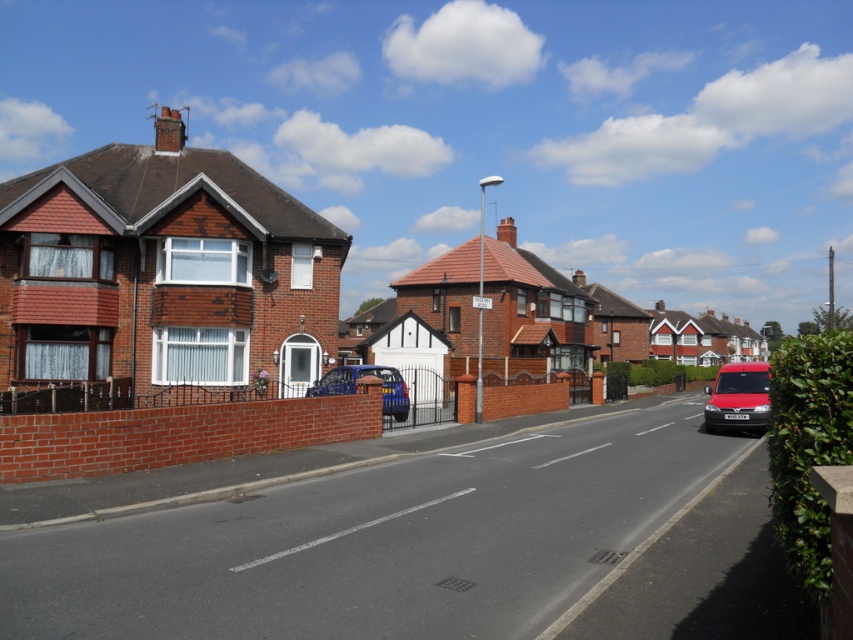
Question: Which point is farther to the camera?

Choices:
 (A) smooth asphalt road at center
 (B) metallic blue car at center
 (C) metallic red van at right

Answer: (B)

Question: Can you confirm if metallic red van at right is wider than metallic blue car at center?

Choices:
 (A) yes
 (B) no

Answer: (A)

Question: Is smooth asphalt road at center bigger than metallic blue car at center?

Choices:
 (A) no
 (B) yes

Answer: (B)

Question: Estimate the real-world distances between objects in this image. Which object is farther from the metallic blue car at center?

Choices:
 (A) metallic red van at right
 (B) smooth asphalt road at center

Answer: (B)

Question: Is smooth asphalt road at center thinner than metallic red van at right?

Choices:
 (A) yes
 (B) no

Answer: (B)

Question: Among these points, which one is nearest to the camera?

Choices:
 (A) (346, 378)
 (B) (733, 380)

Answer: (A)